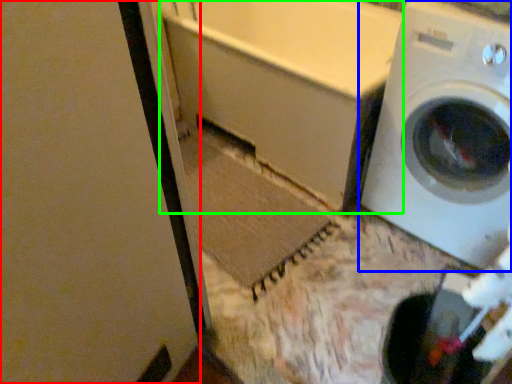
Question: Considering the real-world distances, which object is farthest from screen door (highlighted by a red box)? washing machine (highlighted by a blue box) or bath (highlighted by a green box)?

Choices:
 (A) washing machine
 (B) bath

Answer: (A)